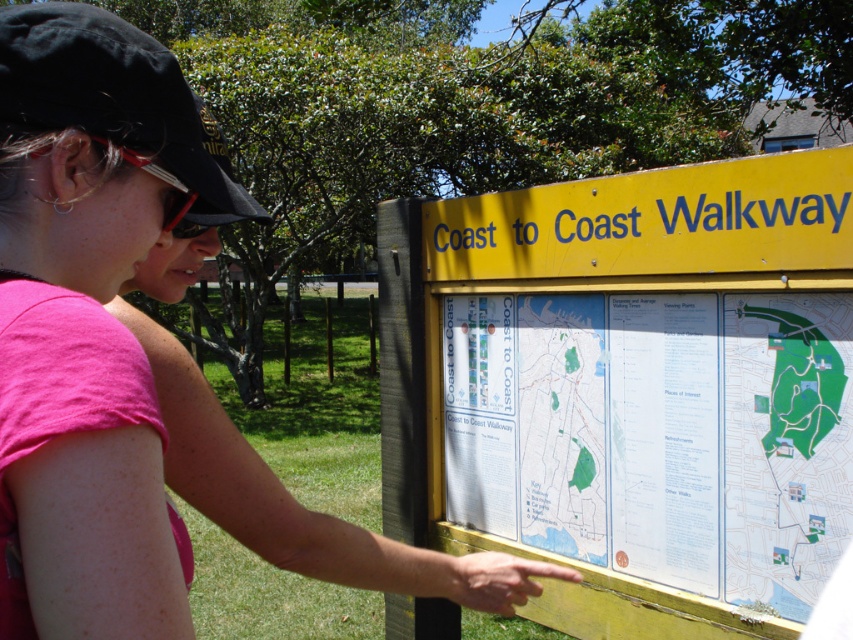
Question: Which object appears closest to the camera in this image?

Choices:
 (A) pink fabric shirt at center
 (B) metallic red sunglasses at upper left

Answer: (A)

Question: Which point appears farthest from the camera in this image?

Choices:
 (A) (184, 212)
 (B) (477, 561)
 (C) (723, 400)

Answer: (C)

Question: Observing the image, what is the correct spatial positioning of green paper map at center in reference to pink fabric shirt at center?

Choices:
 (A) above
 (B) below

Answer: (A)

Question: Which of these objects is positioned farthest from the pink fabric shirt at center?

Choices:
 (A) metallic red sunglasses at upper left
 (B) green paper map at center

Answer: (B)

Question: Does green paper map at center appear under pink fabric shirt at center?

Choices:
 (A) yes
 (B) no

Answer: (B)

Question: From the image, what is the correct spatial relationship of pink fabric shirt at center in relation to metallic red sunglasses at upper left?

Choices:
 (A) above
 (B) below

Answer: (B)